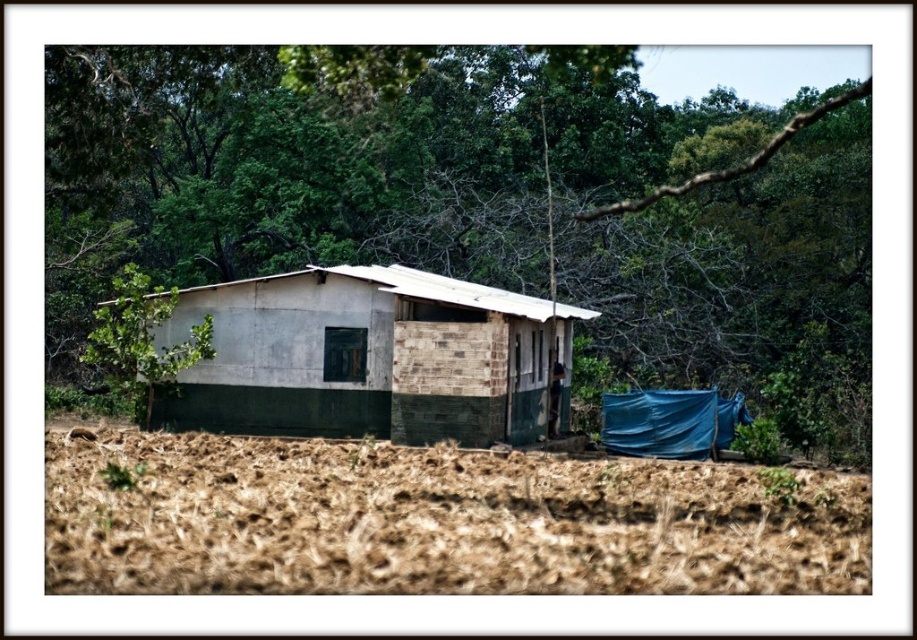
You are standing in front of the house and want to walk towards the white concrete hut at center. Is the green leafy tree at upper center blocking your path?

The green leafy tree at upper center is closer to the viewer than the white concrete hut at center, so it is blocking the path to the white concrete hut at center.

You are standing in front of the rustic house and notice the green leafy tree at upper center and the white concrete hut at center. Which object is positioned higher in the image?

The green leafy tree at upper center is positioned higher than the white concrete hut at center.